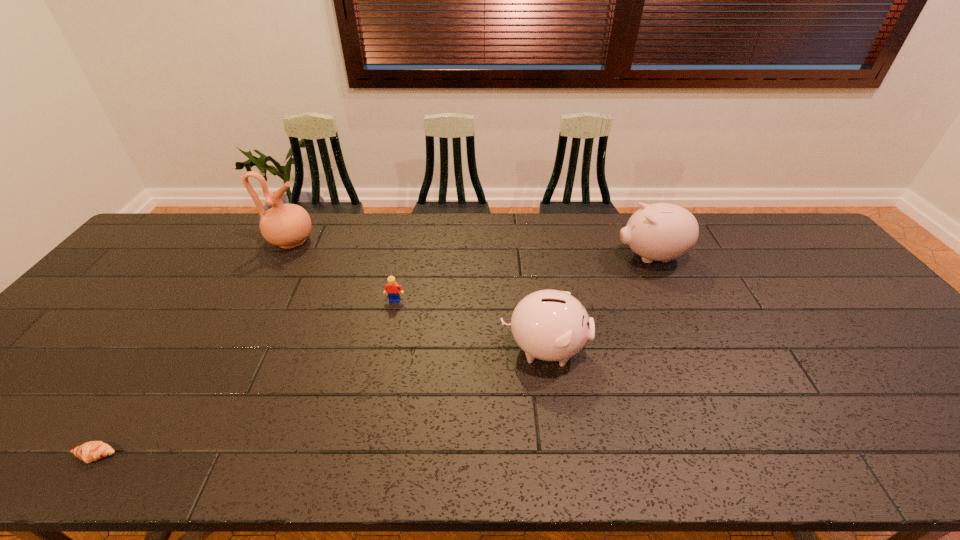
What are the coordinates of `the tallest object` in the screenshot? It's located at (286, 225).

Locate an element on the screen. The width and height of the screenshot is (960, 540). pottery is located at coordinates (286, 225).

Where is `the right piggy bank`? the right piggy bank is located at coordinates (662, 232).

Identify the location of the rightmost object. The image size is (960, 540). (662, 232).

Image resolution: width=960 pixels, height=540 pixels. Identify the location of the fourth farthest object. (550, 325).

Identify the location of the left piggy bank. The height and width of the screenshot is (540, 960). (550, 325).

This screenshot has height=540, width=960. I want to click on Lego, so click(392, 288).

The width and height of the screenshot is (960, 540). Identify the location of the third object from left to right. (392, 288).

Where is `pastry`? pastry is located at coordinates (88, 452).

Identify the location of the nearest object. (88, 452).